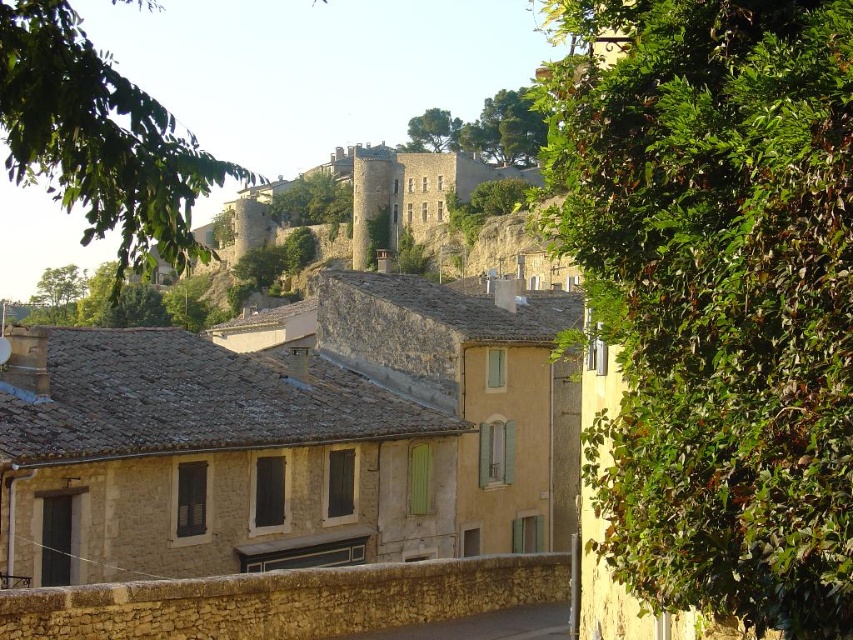
Which is below, stone house at center or gray stone alley at lower center?

gray stone alley at lower center

Is stone house at center below gray stone alley at lower center?

Incorrect, stone house at center is not positioned below gray stone alley at lower center.

What do you see at coordinates (283, 440) in the screenshot? Image resolution: width=853 pixels, height=640 pixels. I see `stone house at center` at bounding box center [283, 440].

What are the coordinates of `stone house at center` in the screenshot? It's located at (283, 440).